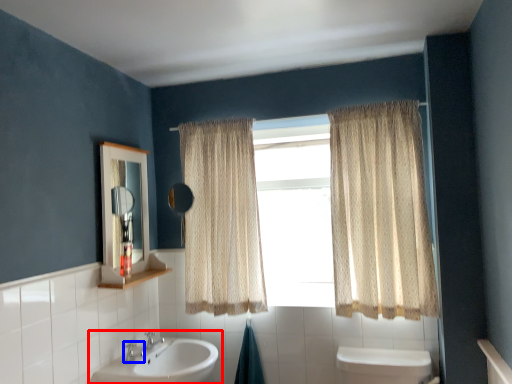
Question: Which of the following is the closest to the observer, sink (highlighted by a red box) or plumbing fixture (highlighted by a blue box)?

Choices:
 (A) sink
 (B) plumbing fixture

Answer: (A)